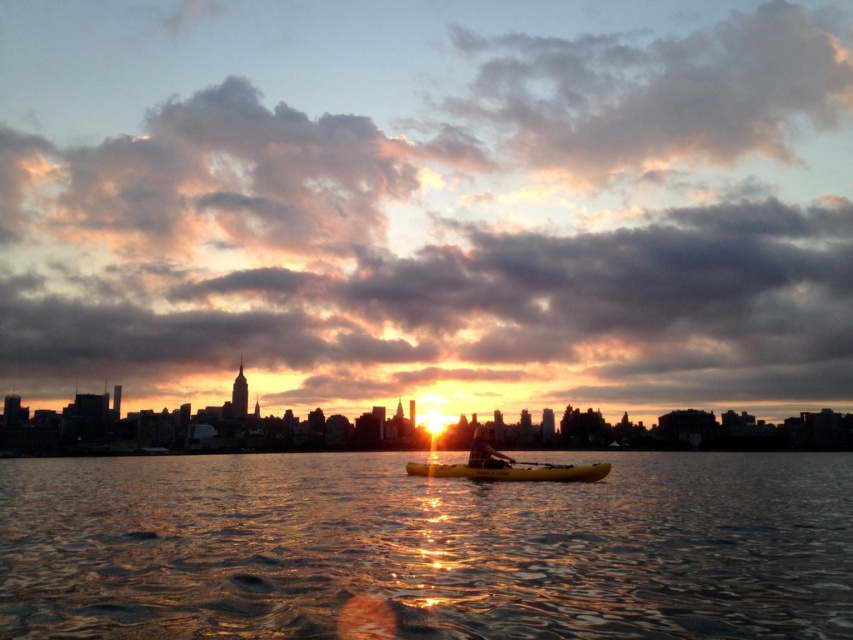
Question: Which of these objects is positioned farthest from the wooden paddle at center?

Choices:
 (A) glistening water at center
 (B) smooth yellow kayak at center

Answer: (A)

Question: Considering the relative positions of glistening water at center and wooden paddle at center in the image provided, where is glistening water at center located with respect to wooden paddle at center?

Choices:
 (A) above
 (B) below

Answer: (B)

Question: In this image, where is yellow matte canoe at center located relative to smooth yellow kayak at center?

Choices:
 (A) left
 (B) right

Answer: (A)

Question: Based on their relative distances, which object is farther from the wooden paddle at center?

Choices:
 (A) glistening water at center
 (B) smooth yellow kayak at center
 (C) yellow matte canoe at center

Answer: (A)

Question: Which point is farther to the camera?

Choices:
 (A) (200, 508)
 (B) (496, 461)

Answer: (A)

Question: Can you confirm if glistening water at center is positioned to the left of smooth yellow kayak at center?

Choices:
 (A) no
 (B) yes

Answer: (B)